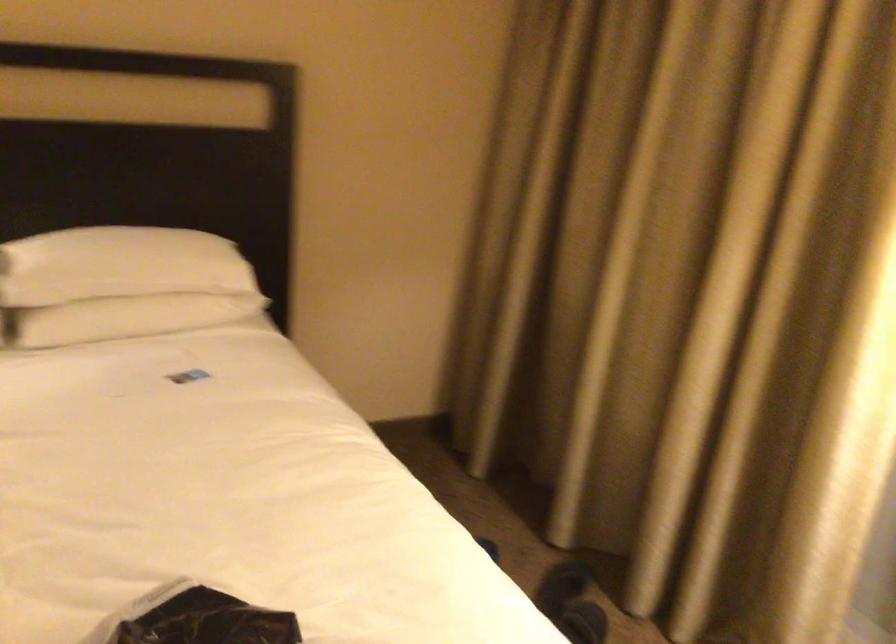
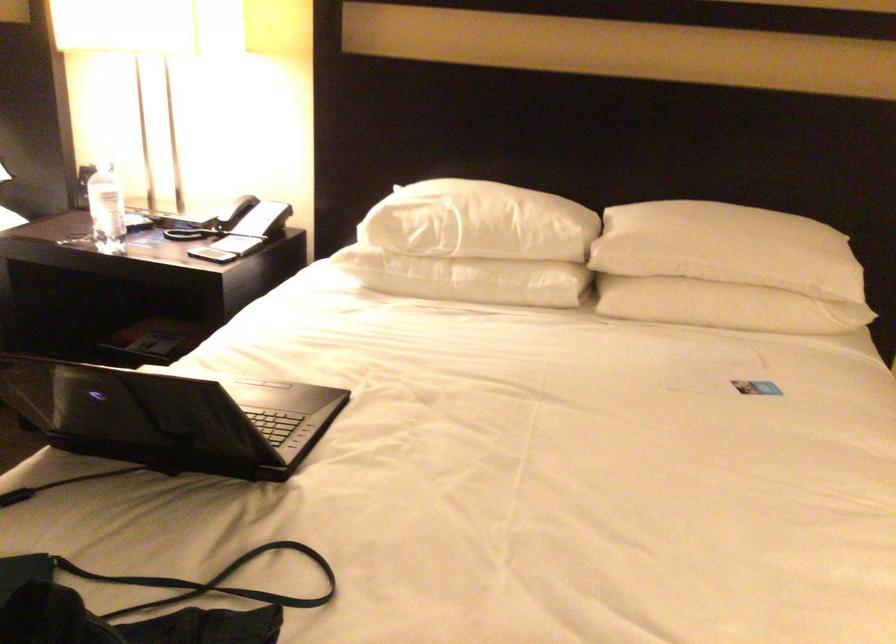
In the second image, find the point that corresponds to pixel 191 379 in the first image.

(755, 386)